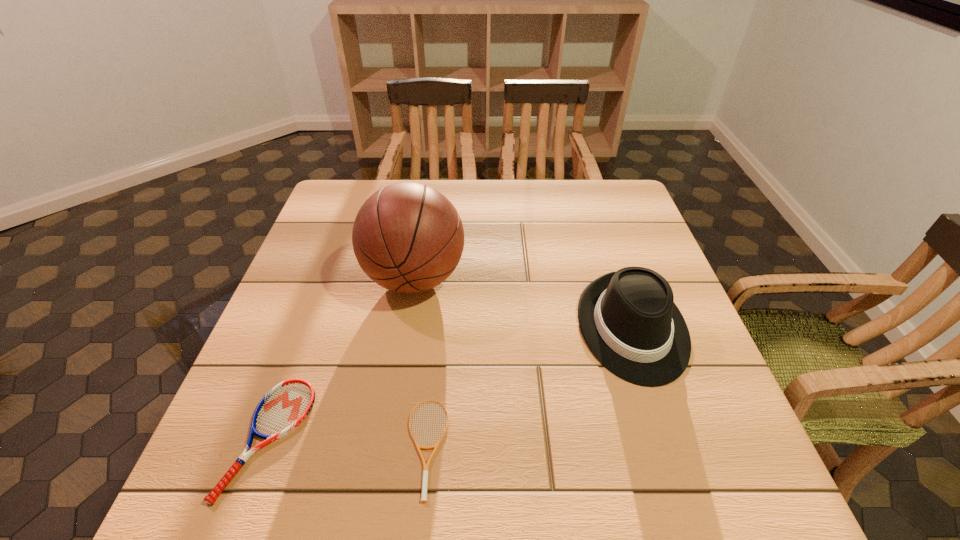
The height and width of the screenshot is (540, 960). I want to click on vacant space situated on the right of the right tennis racket, so [623, 448].

The width and height of the screenshot is (960, 540). What are the coordinates of `object that is at the left edge` in the screenshot? It's located at (285, 406).

Identify the location of object present at the right edge. (628, 319).

This screenshot has width=960, height=540. I want to click on object that is at the near left corner, so click(285, 406).

In the image, there is a desktop. Identify the location of blank space at the far edge. point(565,212).

Identify the location of free space at the near edge of the desktop. The height and width of the screenshot is (540, 960). (340, 509).

Identify the location of vacant space at the left edge of the desktop. (347, 262).

Image resolution: width=960 pixels, height=540 pixels. In order to click on blank space at the right edge in this screenshot , I will do `click(697, 418)`.

The image size is (960, 540). Find the location of `vacant space at the near left corner`. vacant space at the near left corner is located at coordinates (230, 509).

I want to click on vacant point at the far right corner, so click(626, 184).